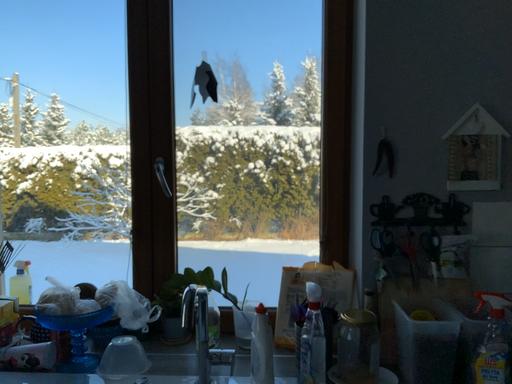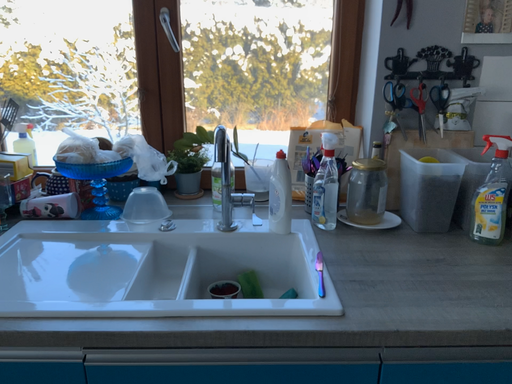
Question: Which way did the camera rotate in the video?

Choices:
 (A) rotated upward
 (B) rotated downward

Answer: (B)